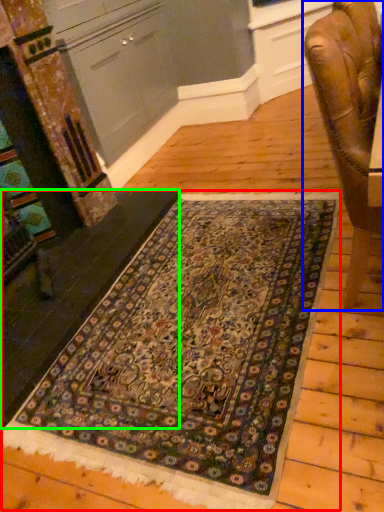
Question: Based on their relative distances, which object is nearer to mat (highlighted by a red box)? Choose from chair (highlighted by a blue box) and stair (highlighted by a green box).

Choices:
 (A) chair
 (B) stair

Answer: (B)